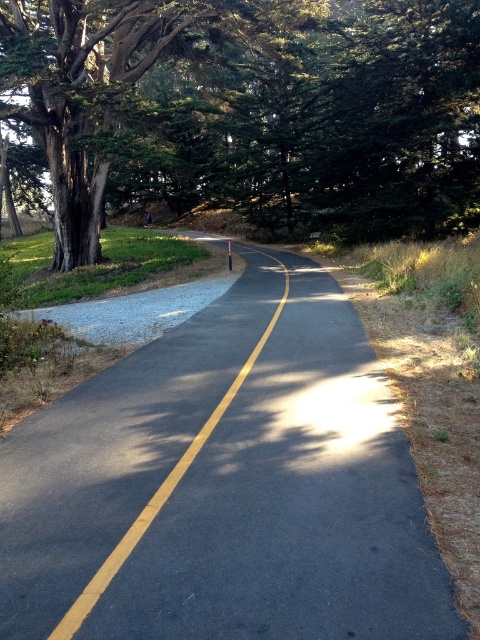
You are driving a car and need to stay on the black asphalt road at center. Which direction should you steer to avoid hitting the green leafy tree at left?

The black asphalt road at center is to the right of the green leafy tree at left, so you should steer to the right to stay on the road and avoid the tree.

Consider the image. You are driving a car and see the black asphalt road at center and the green leafy tree at left. Which object is nearer to you as you drive along the road?

The black asphalt road at center is closer to the viewer than the green leafy tree at left, so the black asphalt road at center is nearer to you.